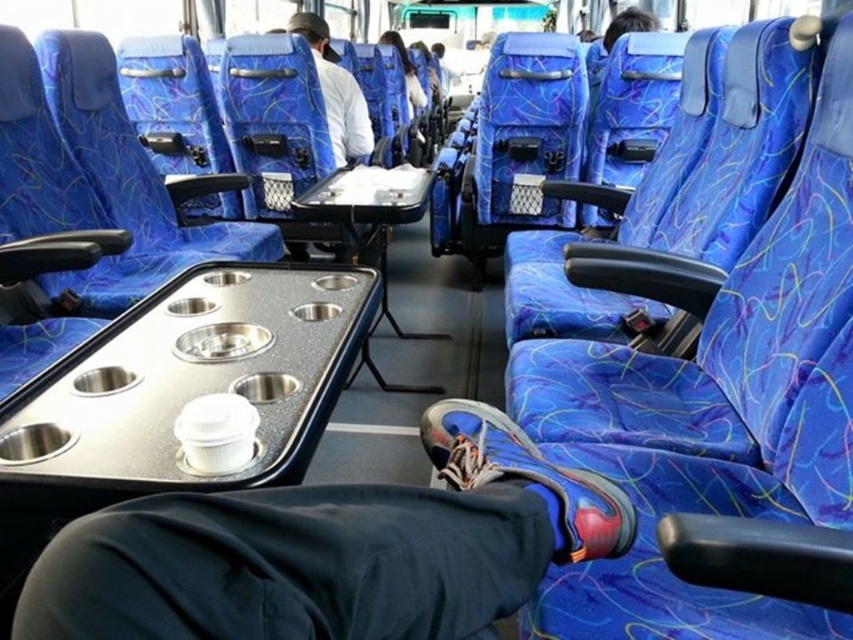
You are standing at the back of the bus and want to walk to the front. There are two points marked on the floor in the image. Which point, point (520, 476) or point (320, 88), is closer to you as you stand at the back?

Point (520, 476) is closer to you because it is closer to the viewer than point (320, 88).

You are a passenger on the bus and you want to place your shiny plastic cup at center on the tray table behind your blue synthetic shoe at lower center. Can you reach it without moving your shoe?

The shiny plastic cup at center is in front of the blue synthetic shoe at lower center, so you can reach it by moving the cup backward towards the tray table without needing to move the shoe.

You are a passenger on the bus and want to know if your blue synthetic shoe at lower center can fit into the space below the matte white shirt at center. Based on their sizes, can it fit?

The blue synthetic shoe at lower center is shorter than the matte white shirt at center, so it should fit into the space below the matte white shirt at center.